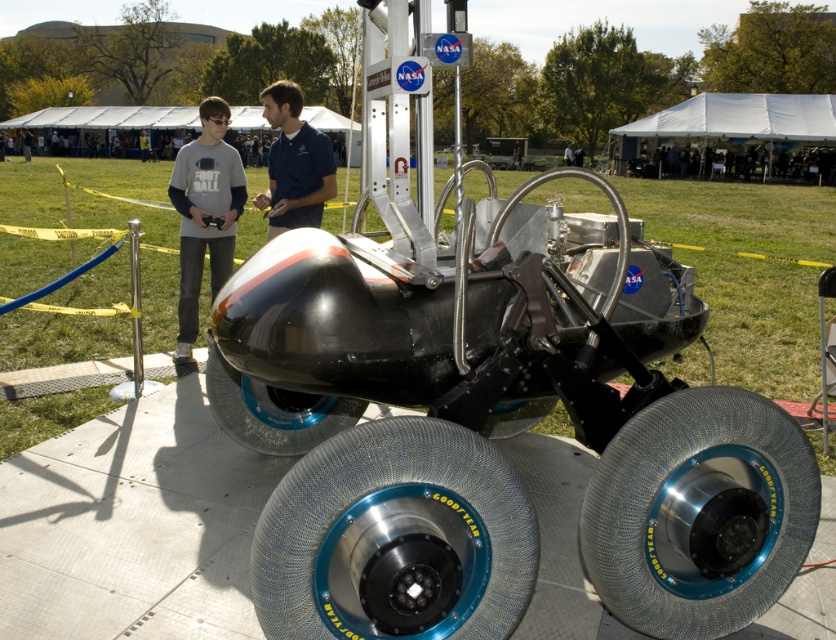
Question: Is the position of gray cotton shirt at left more distant than that of metallic silver wheel at center?

Choices:
 (A) no
 (B) yes

Answer: (B)

Question: Where is metallic mesh tire at center located in relation to metallic/textured wheel at center in the image?

Choices:
 (A) above
 (B) below

Answer: (B)

Question: Is gray cotton shirt at left above metallic silver wheel at center?

Choices:
 (A) no
 (B) yes

Answer: (A)

Question: Among these objects, which one is nearest to the camera?

Choices:
 (A) metallic silver wheel at center
 (B) metallic mesh tire at lower right

Answer: (B)

Question: Which object is positioned closest to the shiny metallic wheel at center?

Choices:
 (A) metallic mesh tire at center
 (B) blue cotton shirt at center
 (C) metallic/textured wheel at center

Answer: (C)

Question: Considering the real-world distances, which object is closest to the shiny metallic wheel at center?

Choices:
 (A) metallic mesh tire at lower right
 (B) metallic/textured wheel at center
 (C) gray cotton shirt at left

Answer: (B)